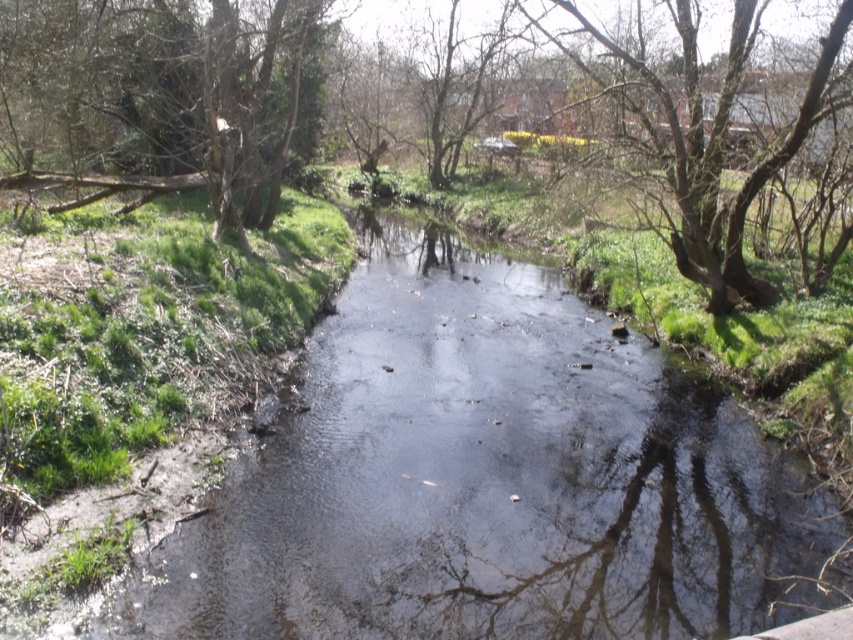
You are a hiker standing at the edge of the stream. You see the transparent water at center and the green leafy tree at left. Which object is closer to you?

The transparent water at center is closer to you because it is in front of the green leafy tree at left.

You are standing at the point marked by point [155,97]. Looking around, you see a green leafy tree at left. Which direction should you walk to reach the stream?

The point [155,97] indicates the green leafy tree at left, so you are already at the location of the green leafy tree at left. To reach the stream, you should walk towards the right, away from the tree, since the stream is on the opposite side of the tree from your current position.

You are standing at the edge of the stream and want to place two markers at the coordinates point (x=378, y=365) and point (x=746, y=195). Which marker will appear higher in your view?

Point (x=746, y=195) will appear higher in your view because it is further away from the camera compared to point (x=378, y=365), which is closer.